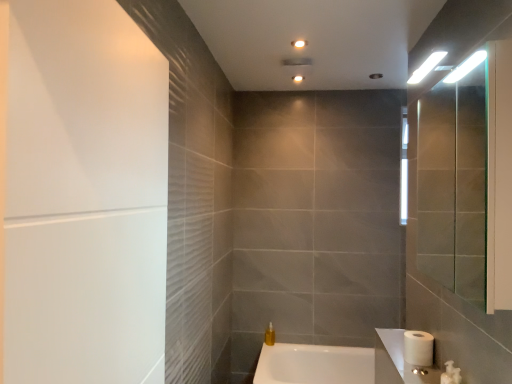
Where is `vacant area that is in front of matte white ceiling light at upper center`? This screenshot has height=384, width=512. vacant area that is in front of matte white ceiling light at upper center is located at coordinates (294, 71).